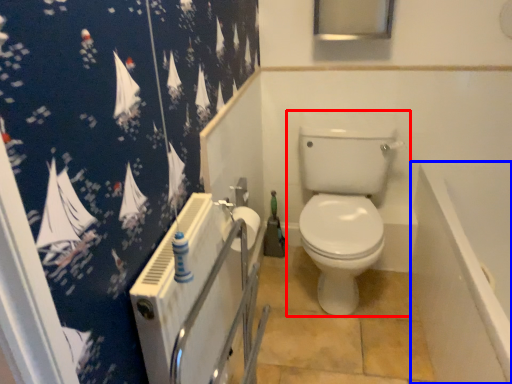
Question: Which of the following is the closest to the observer, toilet (highlighted by a red box) or bath (highlighted by a blue box)?

Choices:
 (A) toilet
 (B) bath

Answer: (B)